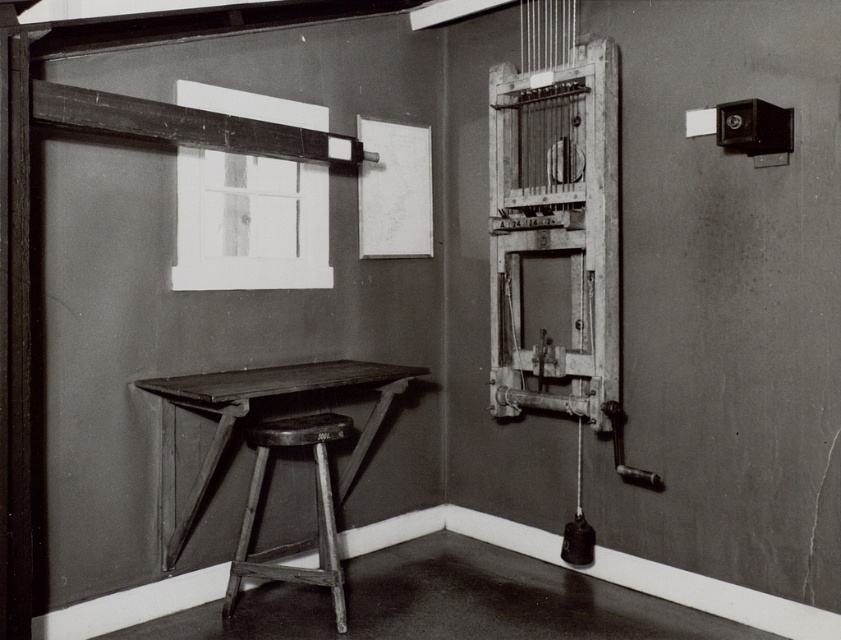
Question: Does wooden/crude wooden cage at right come behind wooden table at lower left?

Choices:
 (A) yes
 (B) no

Answer: (A)

Question: Which of these objects is positioned closest to the wooden/crude wooden cage at right?

Choices:
 (A) white matte window at upper center
 (B) wooden stool at lower left
 (C) wooden table at lower left

Answer: (C)

Question: Is white matte window at upper center positioned in front of wooden stool at lower left?

Choices:
 (A) yes
 (B) no

Answer: (B)

Question: Which point is closer to the camera taking this photo?

Choices:
 (A) (316, 116)
 (B) (580, 106)

Answer: (B)

Question: Which object is farther from the camera taking this photo?

Choices:
 (A) wooden stool at lower left
 (B) white matte window at upper center
 (C) wooden/crude wooden cage at right
 (D) wooden table at lower left

Answer: (C)

Question: Can you confirm if white matte window at upper center is smaller than wooden stool at lower left?

Choices:
 (A) yes
 (B) no

Answer: (B)